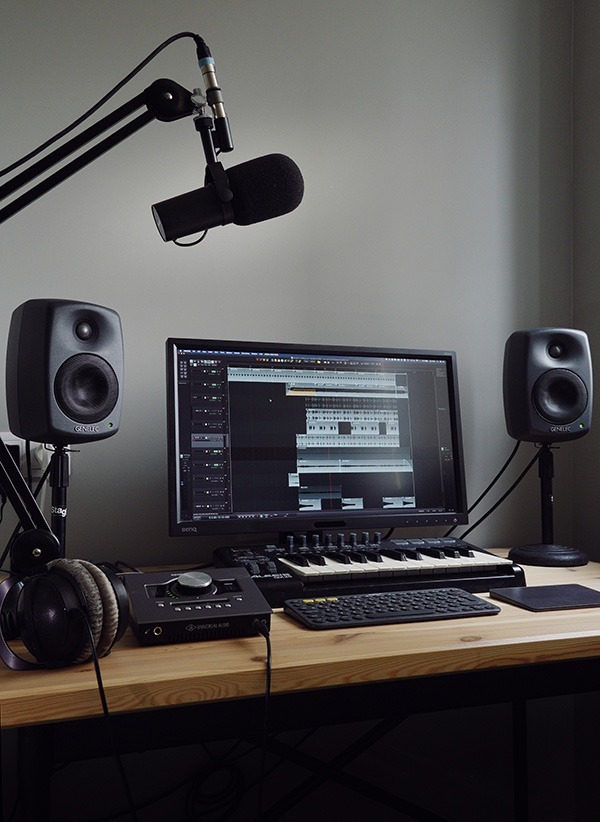
The height and width of the screenshot is (822, 600). What are the coordinates of `monitor` in the screenshot? It's located at (332, 462).